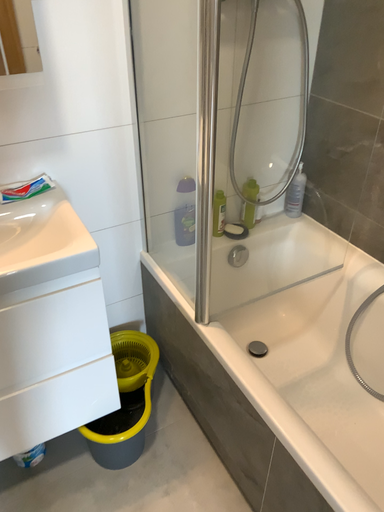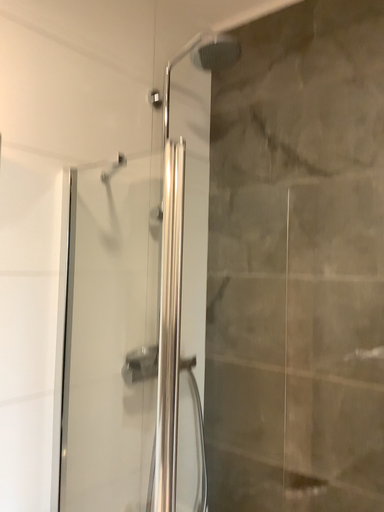
Question: Which way did the camera rotate in the video?

Choices:
 (A) rotated downward
 (B) rotated upward

Answer: (B)